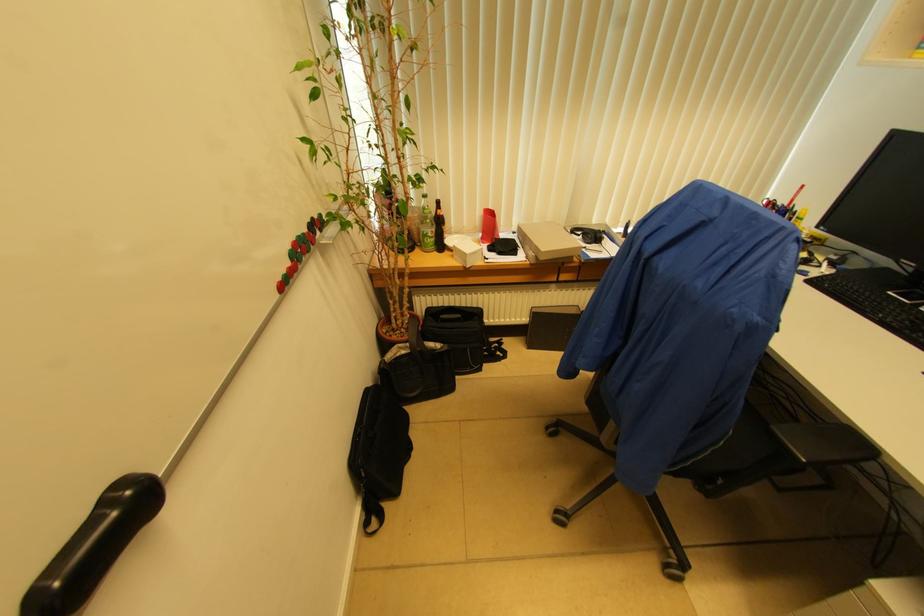
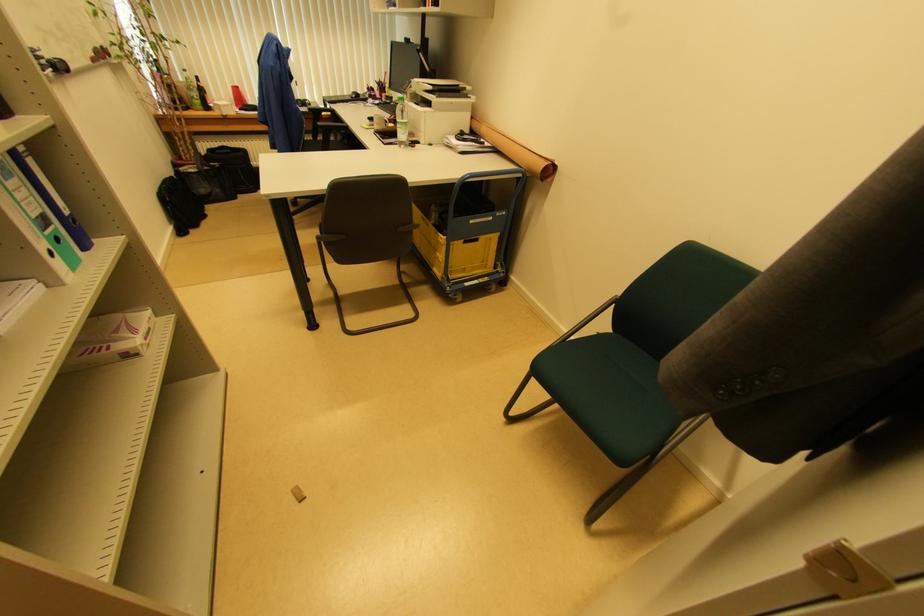
The point at (435,233) is marked in the first image. Where is the corresponding point in the second image?

(200, 98)